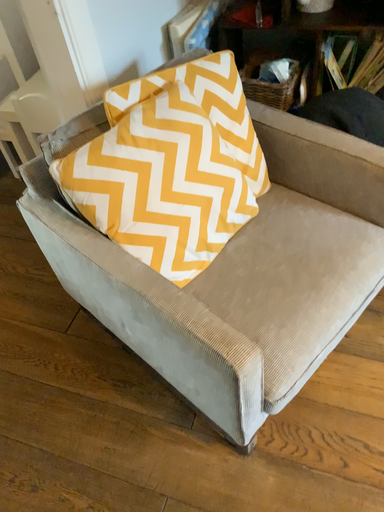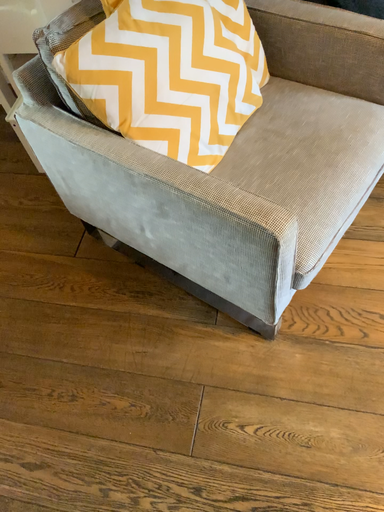
Question: Which way did the camera rotate in the video?

Choices:
 (A) rotated downward
 (B) rotated upward

Answer: (A)